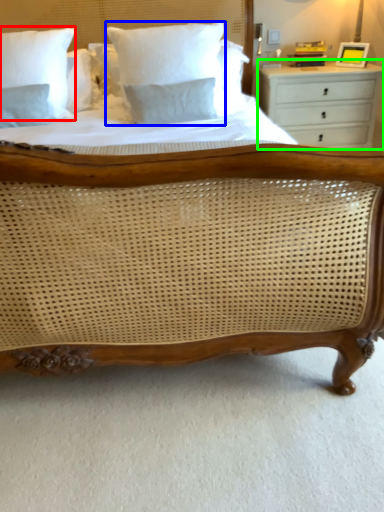
Question: Which is farther away from pillow (highlighted by a red box)? pillow (highlighted by a blue box) or chest of drawers (highlighted by a green box)?

Choices:
 (A) pillow
 (B) chest of drawers

Answer: (B)